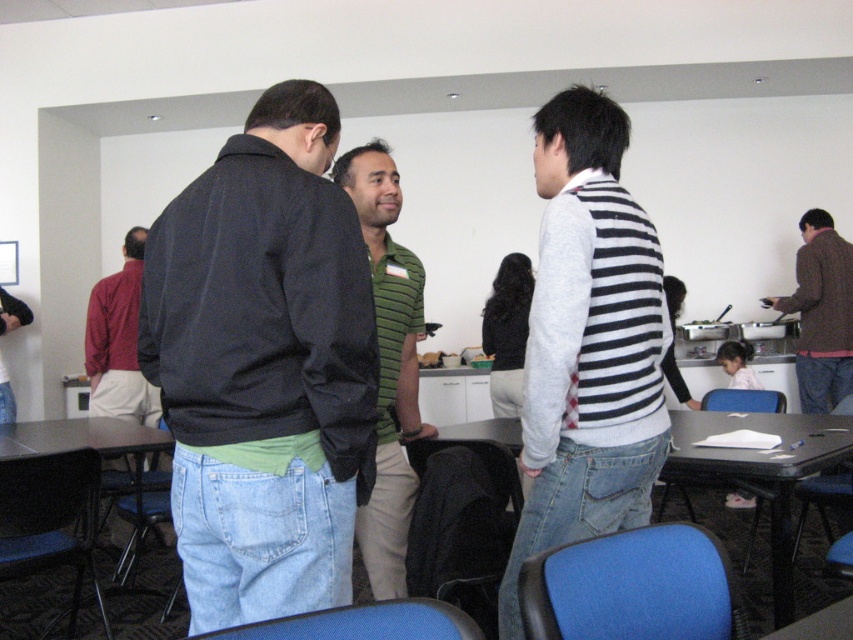
Question: Observing the image, what is the correct spatial positioning of brown woolen sweater at right in reference to matte plastic table at center?

Choices:
 (A) below
 (B) above

Answer: (B)

Question: Which object is the closest to the brown woolen sweater at right?

Choices:
 (A) matte plastic table at center
 (B) matte blue table at center
 (C) green striped shirt at center

Answer: (B)

Question: Among these objects, which one is nearest to the camera?

Choices:
 (A) denim jacket at center
 (B) matte blue table at center

Answer: (A)

Question: Does striped sweater at center appear on the right side of matte plastic table at center?

Choices:
 (A) yes
 (B) no

Answer: (A)

Question: Does matte blue table at center appear on the right side of brown woolen sweater at right?

Choices:
 (A) yes
 (B) no

Answer: (B)

Question: Which point is farther to the camera?

Choices:
 (A) (807, 237)
 (B) (403, 440)
 (C) (245, 595)

Answer: (A)